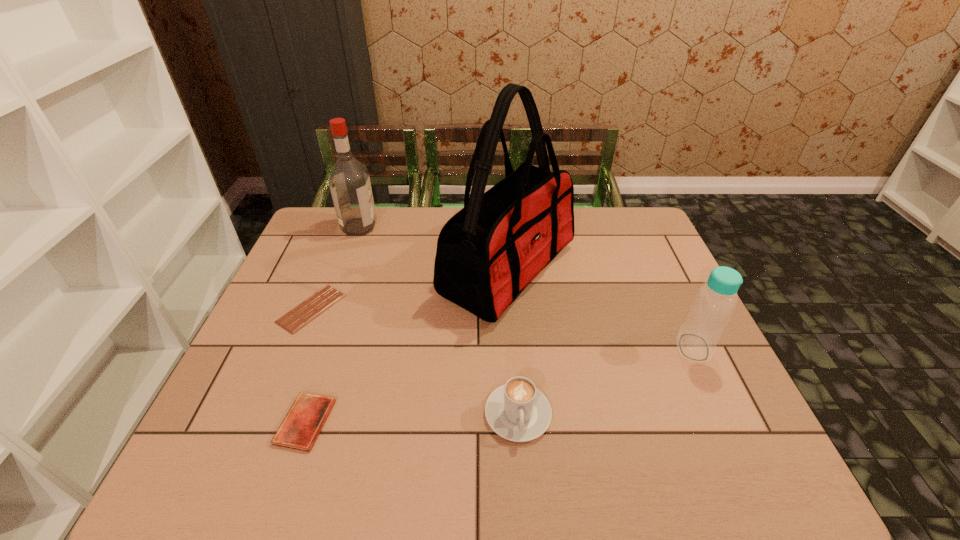
At what (x,y) coordinates should I click in order to perform the action: click on object located at the right edge. Please return your answer as a coordinate pair (x, y). This screenshot has width=960, height=540. Looking at the image, I should click on (715, 301).

Locate an element on the screen. The height and width of the screenshot is (540, 960). object that is at the far left corner is located at coordinates (349, 181).

Locate an element on the screen. object that is at the near left corner is located at coordinates (300, 428).

Identify the location of free point at the far edge. This screenshot has width=960, height=540. (421, 228).

In the image, there is a desktop. Where is `free space at the near edge`? free space at the near edge is located at coordinates (640, 454).

Find the location of a particular element. free space at the left edge of the desktop is located at coordinates (246, 372).

In the image, there is a desktop. At what (x,y) coordinates should I click in order to perform the action: click on vacant region at the right edge. Please return your answer as a coordinate pair (x, y). The image size is (960, 540). Looking at the image, I should click on (684, 305).

In the image, there is a desktop. At what (x,y) coordinates should I click in order to perform the action: click on vacant space at the far left corner. Please return your answer as a coordinate pair (x, y). Looking at the image, I should click on (306, 240).

The height and width of the screenshot is (540, 960). What are the coordinates of `vacant space at the near right corner of the desktop` in the screenshot? It's located at (753, 447).

Locate an element on the screen. This screenshot has height=540, width=960. empty location between the chocolate bar and the third tallest object is located at coordinates (502, 328).